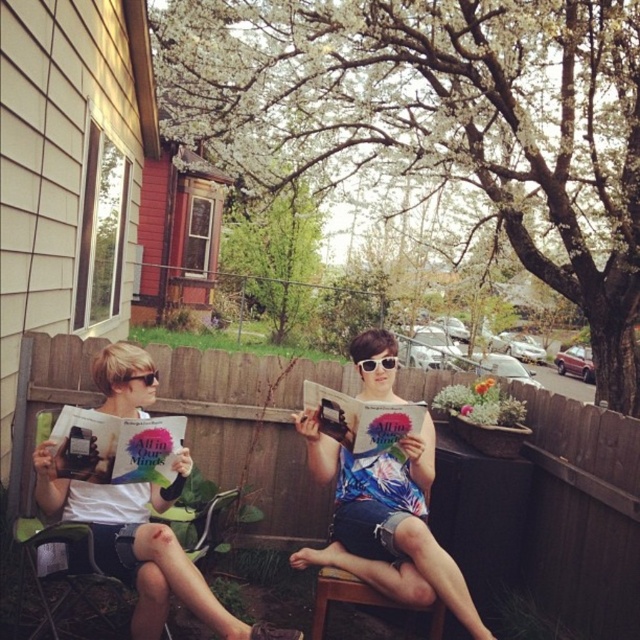
Question: Which point is farther from the camera taking this photo?

Choices:
 (A) tap(429, 637)
 (B) tap(51, 436)
 (C) tap(392, 358)

Answer: (C)

Question: Where is floral fabric shirt at center located in relation to matte white book at center in the image?

Choices:
 (A) above
 (B) below

Answer: (B)

Question: Can you confirm if white blossoming tree at upper center is positioned to the right of floral fabric shirt at center?

Choices:
 (A) yes
 (B) no

Answer: (A)

Question: Is floral fabric shirt at center below sunglasses at center?

Choices:
 (A) no
 (B) yes

Answer: (B)

Question: Which is nearer to the matte white book at left?

Choices:
 (A) floral fabric shirt at center
 (B) wooden chair at center
 (C) white blossoming tree at upper center

Answer: (A)

Question: Which point appears closest to the camera in this image?

Choices:
 (A) (348, 109)
 (B) (291, 282)

Answer: (A)